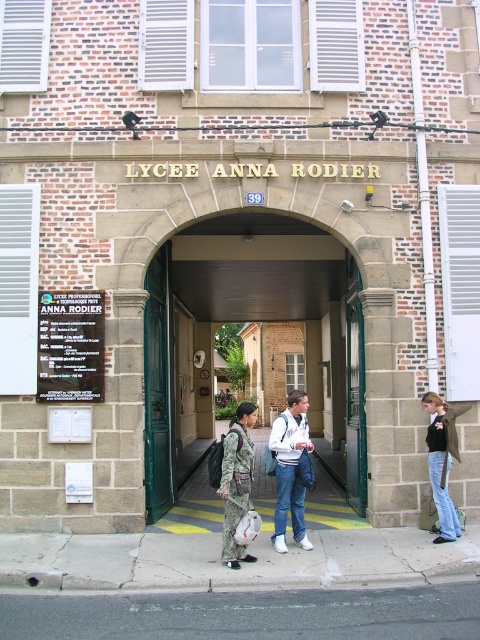
Question: Which object is closer to the camera taking this photo?

Choices:
 (A) blue jeans at lower right
 (B) camouflage fabric jacket at center

Answer: (B)

Question: Based on their relative distances, which object is nearer to the blue jeans at lower right?

Choices:
 (A) green wooden door at center
 (B) camouflage fabric jacket at center
 (C) black plastic sign at center
 (D) white matte jacket at center

Answer: (D)

Question: Which object is farther from the camera taking this photo?

Choices:
 (A) blue jeans at lower right
 (B) camouflage fabric jacket at center
 (C) green wooden door at center

Answer: (A)

Question: Does green wooden door at center appear on the right side of white matte jacket at center?

Choices:
 (A) no
 (B) yes

Answer: (A)

Question: Does white matte jacket at center have a greater width compared to blue jeans at lower right?

Choices:
 (A) yes
 (B) no

Answer: (A)

Question: Can you confirm if gray asphalt at lower center is positioned below blue jeans at lower right?

Choices:
 (A) yes
 (B) no

Answer: (A)